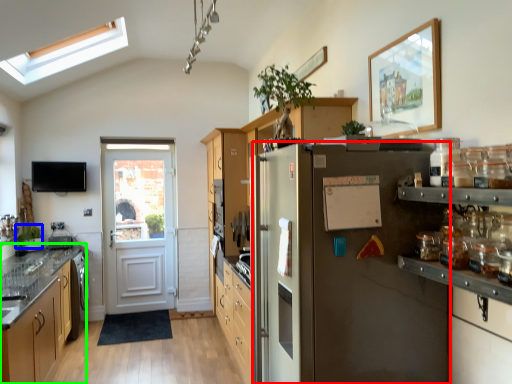
Question: Which object is positioned farthest from refrigerator (highlighted by a red box)? Select from plant (highlighted by a blue box) and cabinetry (highlighted by a green box).

Choices:
 (A) plant
 (B) cabinetry

Answer: (A)